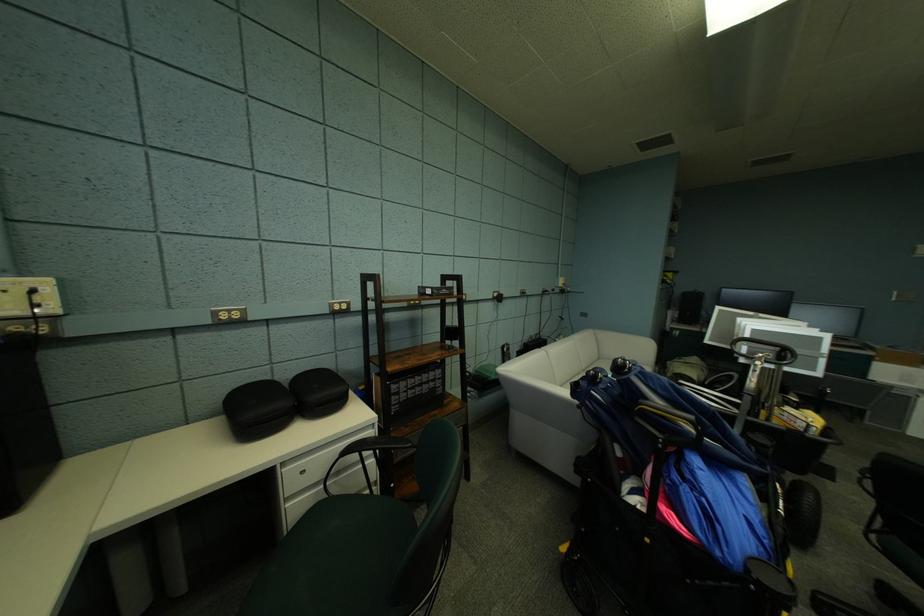
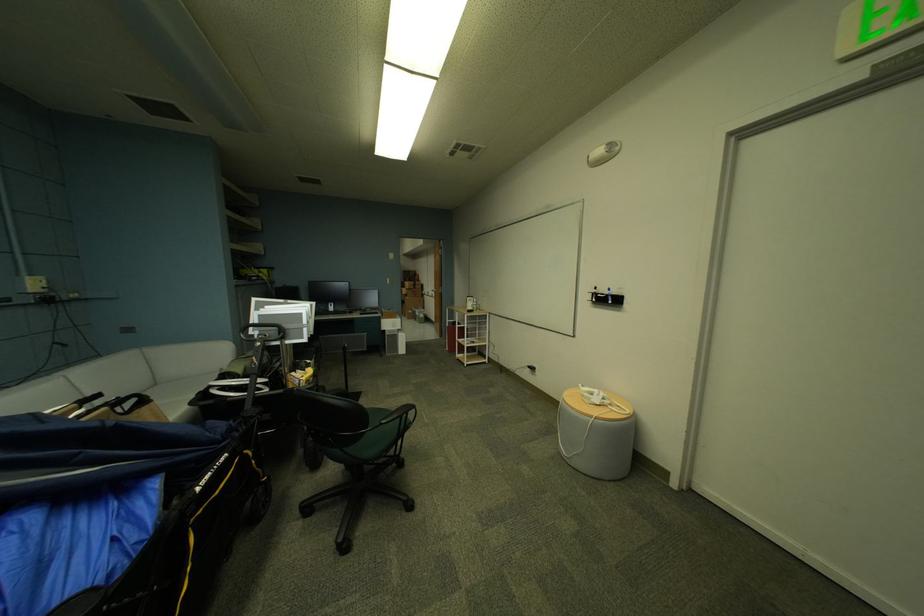
Locate, in the second image, the point that corresponds to (x=608, y=360) in the first image.

(164, 386)